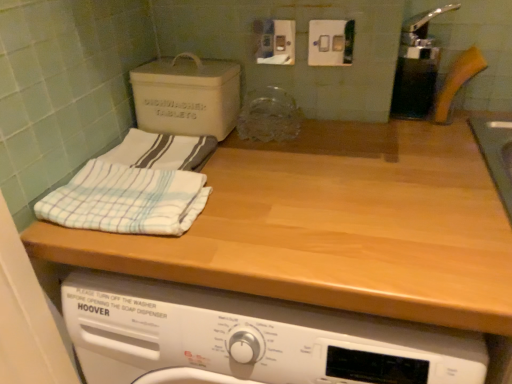
Where is `vacant point to the right of white striped cloth at left, which is the first bath towel from front to back`? This screenshot has width=512, height=384. vacant point to the right of white striped cloth at left, which is the first bath towel from front to back is located at coordinates (251, 194).